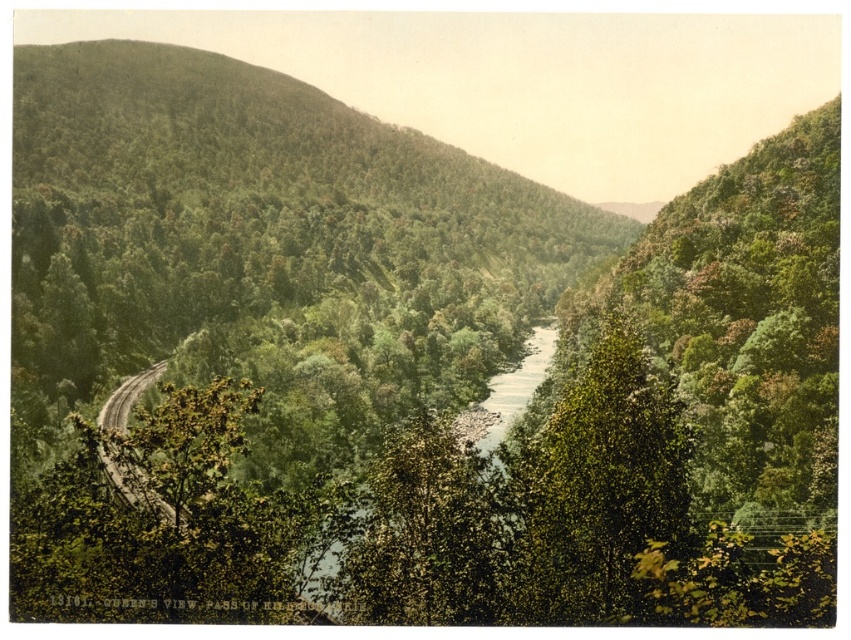
You are a hiker who wants to cross the green leafy river at center. You see the brown gravel road at lower left nearby. Which direction should you walk to reach the river from the road?

The green leafy river at center is to the right of the brown gravel road at lower left, so you should walk to the right to reach the river from the road.

You are an explorer trying to navigate through the valley. You see a green leafy tree at center and a brown gravel road at lower left. Which object would appear closer to you if you are standing at the valley entrance?

The brown gravel road at lower left appears closer because it is at the lower part of the image, which typically represents the foreground in such scenes.